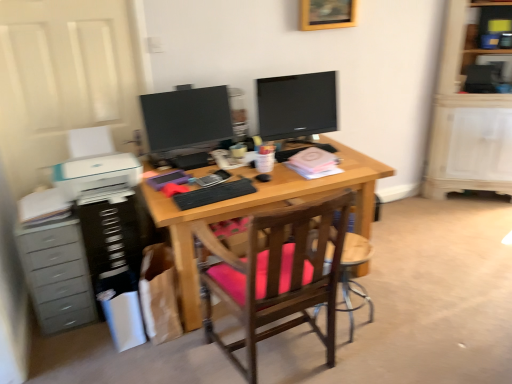
Identify the location of free region on the left part of wooden chair at center. (295, 344).